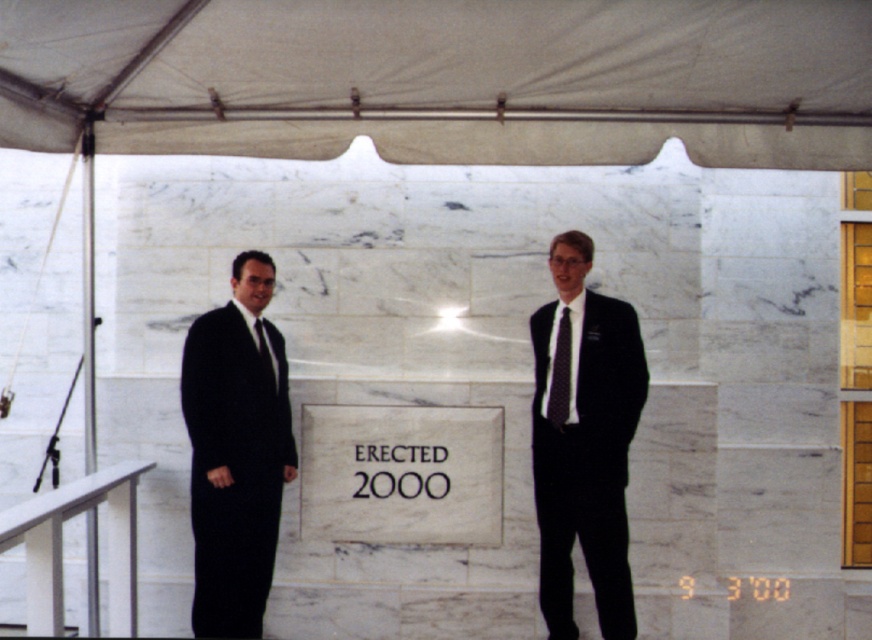
Is point (26, 499) positioned after point (567, 330)?

Yes, it is behind point (567, 330).

Can you confirm if metallic silver rail at lower left is wider than black silk tie at right?

Yes.

Who is more forward, [106,470] or [557,358]?

Positioned in front is point [557,358].

Where is `metallic silver rail at lower left`? This screenshot has width=872, height=640. metallic silver rail at lower left is located at coordinates tap(60, 545).

In the scene shown: Can you confirm if black satin suit at left is bigger than black silk tie at left?

Indeed, black satin suit at left has a larger size compared to black silk tie at left.

Who is taller, black satin suit at left or black silk tie at left?

With more height is black satin suit at left.

Who is more distant from viewer, (x=206, y=586) or (x=267, y=364)?

The point (x=267, y=364) is behind.

This screenshot has height=640, width=872. I want to click on black satin suit at left, so click(x=235, y=452).

Can you confirm if black satin suit at center is positioned above black satin suit at left?

Yes, black satin suit at center is above black satin suit at left.

Looking at this image, does black satin suit at center come in front of black satin suit at left?

No, black satin suit at center is further to the viewer.

Does point (569, 301) come behind point (269, 339)?

No, it is in front of (269, 339).

Where is `black satin suit at center`? black satin suit at center is located at coordinates (583, 440).